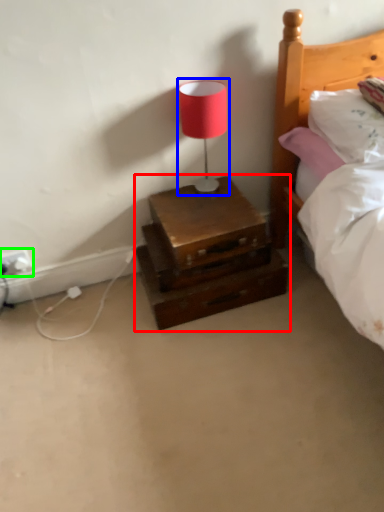
Question: Which object is the closest to the nightstand (highlighted by a red box)? Choose among these: table lamp (highlighted by a blue box) or electric outlet (highlighted by a green box).

Choices:
 (A) table lamp
 (B) electric outlet

Answer: (A)